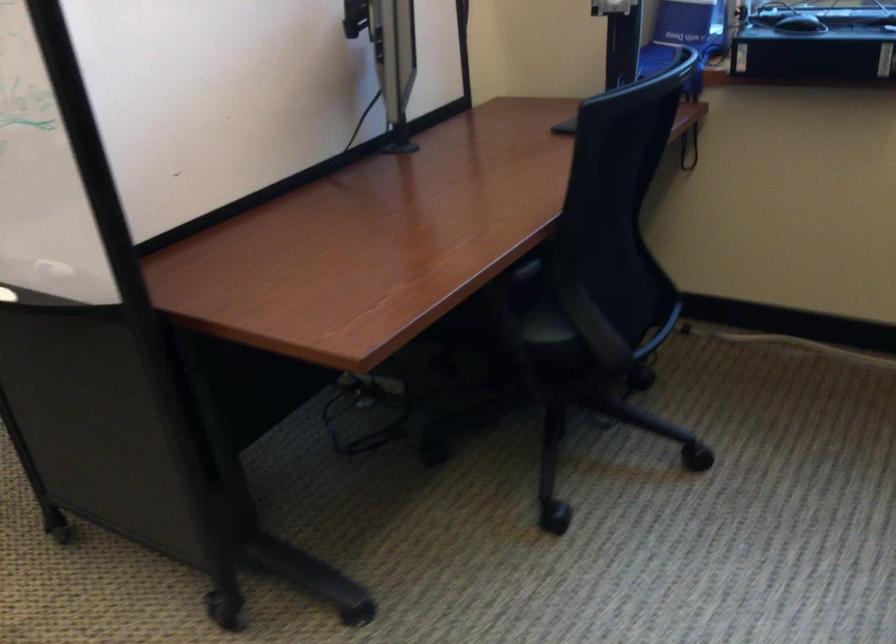
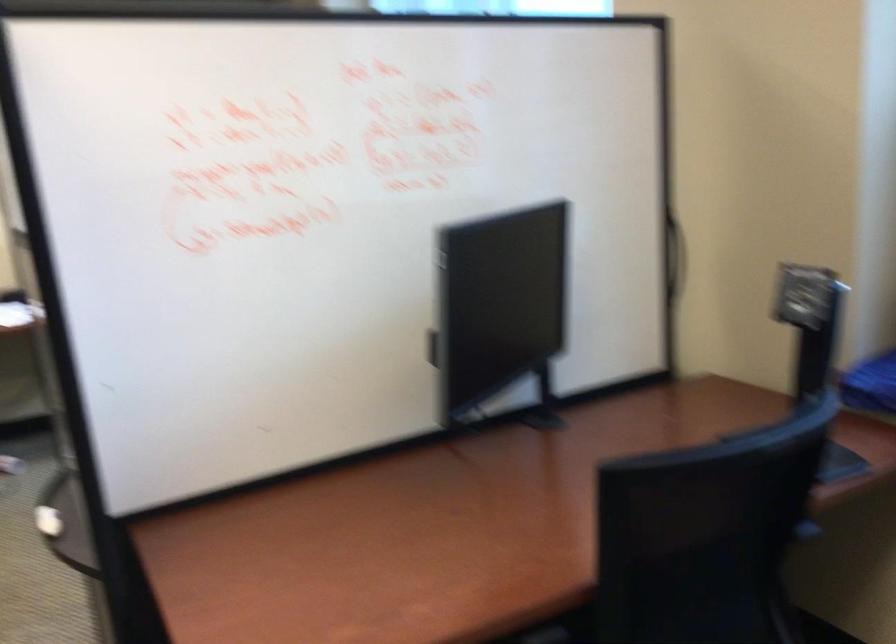
Question: The images are taken continuously from a first-person perspective. In which direction is your viewpoint rotating?

Choices:
 (A) Left
 (B) Right
 (C) Up
 (D) Down

Answer: (A)